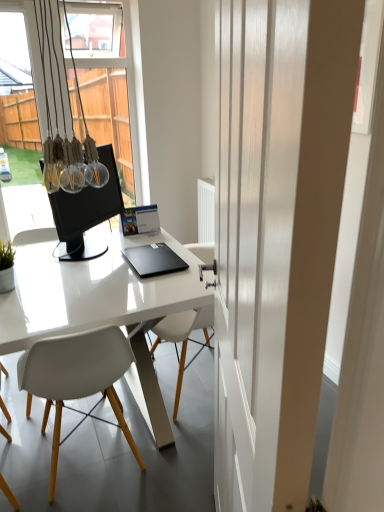
Question: Can you confirm if white glossy door at center is positioned to the right of white plastic chair at center?

Choices:
 (A) yes
 (B) no

Answer: (A)

Question: Does white glossy door at center have a greater height compared to white plastic chair at center?

Choices:
 (A) no
 (B) yes

Answer: (B)

Question: From the image's perspective, is white glossy door at center located beneath white plastic chair at center?

Choices:
 (A) no
 (B) yes

Answer: (A)

Question: Is white glossy door at center positioned behind white plastic chair at center?

Choices:
 (A) yes
 (B) no

Answer: (B)

Question: From the image's perspective, would you say white glossy door at center is positioned over white plastic chair at center?

Choices:
 (A) yes
 (B) no

Answer: (A)

Question: Would you say white glossy door at center contains white plastic chair at center?

Choices:
 (A) no
 (B) yes

Answer: (A)

Question: From the image's perspective, is black matte laptop at center beneath white glossy door at center?

Choices:
 (A) yes
 (B) no

Answer: (B)

Question: Considering the relative positions of black matte laptop at center and white glossy door at center in the image provided, is black matte laptop at center behind white glossy door at center?

Choices:
 (A) yes
 (B) no

Answer: (A)

Question: Would you say black matte laptop at center contains white glossy door at center?

Choices:
 (A) yes
 (B) no

Answer: (B)

Question: Does black matte laptop at center turn towards white glossy door at center?

Choices:
 (A) yes
 (B) no

Answer: (B)

Question: From a real-world perspective, is black matte laptop at center under white glossy door at center?

Choices:
 (A) no
 (B) yes

Answer: (B)

Question: Considering the relative positions of black matte laptop at center and white glossy door at center in the image provided, is black matte laptop at center to the left of white glossy door at center from the viewer's perspective?

Choices:
 (A) no
 (B) yes

Answer: (B)

Question: Can you confirm if matte black monitor at center is smaller than white glossy door at center?

Choices:
 (A) no
 (B) yes

Answer: (B)